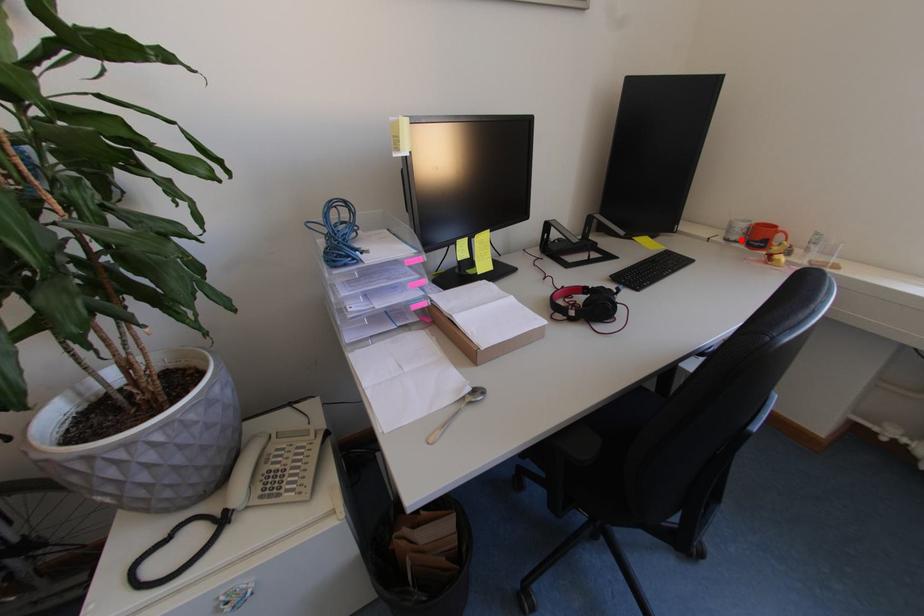
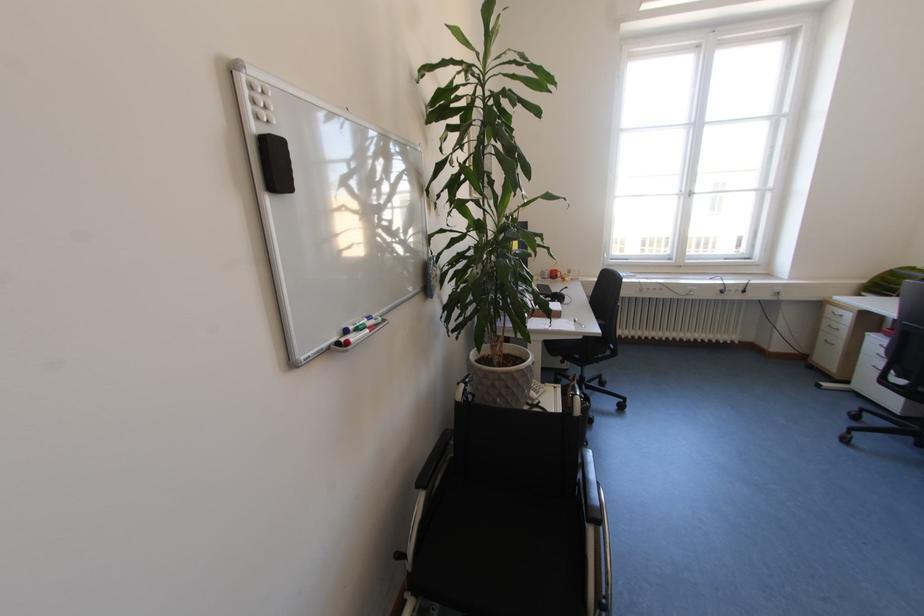
The point at the highlighted location is marked in the first image. Where is the corresponding point in the second image?

(553, 278)